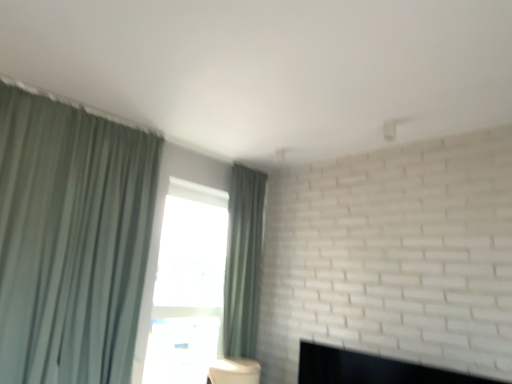
Find the location of a particular element. green fabric curtain at left, which is counted as the 1th curtain, starting from the left is located at coordinates (71, 240).

Measure the distance between black matte fireplace at lower right and camera.

They are 7.15 feet apart.

This screenshot has width=512, height=384. In order to click on green fabric curtain at center, positioned as the second curtain in front-to-back order in this screenshot , I will do `click(243, 262)`.

Identify the location of green fabric curtain at left, arranged as the second curtain when viewed from the right. (71, 240).

Could you tell me if green fabric curtain at left, which is counted as the 1th curtain, starting from the left, is facing black matte fireplace at lower right?

No, green fabric curtain at left, which is counted as the 1th curtain, starting from the left, is not turned towards black matte fireplace at lower right.

From the picture: From a real-world perspective, relative to black matte fireplace at lower right, is green fabric curtain at left, arranged as the second curtain when viewed from the right, vertically above or below?

green fabric curtain at left, arranged as the second curtain when viewed from the right, is situated higher than black matte fireplace at lower right in the real world.

Which of these two, green fabric curtain at left, which is counted as the 1th curtain, starting from the left, or black matte fireplace at lower right, is wider?

green fabric curtain at left, which is counted as the 1th curtain, starting from the left.

How far apart are green fabric curtain at left, positioned as the 2th curtain in back-to-front order, and black matte fireplace at lower right?

green fabric curtain at left, positioned as the 2th curtain in back-to-front order, is 5.18 feet from black matte fireplace at lower right.

Does black matte fireplace at lower right come in front of green fabric curtain at left, which ranks as the first curtain in front-to-back order?

Yes, black matte fireplace at lower right is in front of green fabric curtain at left, which ranks as the first curtain in front-to-back order.

Based on their sizes in the image, would you say black matte fireplace at lower right is bigger or smaller than green fabric curtain at left, arranged as the second curtain when viewed from the right?

In the image, black matte fireplace at lower right appears to be smaller than green fabric curtain at left, arranged as the second curtain when viewed from the right.

Is black matte fireplace at lower right looking in the opposite direction of green fabric curtain at left, which ranks as the first curtain in front-to-back order?

That's not correct — black matte fireplace at lower right is not looking away from green fabric curtain at left, which ranks as the first curtain in front-to-back order.

Is black matte fireplace at lower right looking in the opposite direction of green fabric curtain at center, positioned as the second curtain in front-to-back order?

No, black matte fireplace at lower right is not facing away from green fabric curtain at center, positioned as the second curtain in front-to-back order.

Is black matte fireplace at lower right in front of or behind green fabric curtain at center, positioned as the second curtain in front-to-back order, in the image?

In the image, black matte fireplace at lower right appears in front of green fabric curtain at center, positioned as the second curtain in front-to-back order.

Which point is more distant from viewer, [226,334] or [364,366]?

The point [226,334] is farther.

Measure the distance between green fabric curtain at center, positioned as the second curtain in front-to-back order, and black matte fireplace at lower right.

green fabric curtain at center, positioned as the second curtain in front-to-back order, and black matte fireplace at lower right are 1.17 meters apart.

From a real-world perspective, which object rests below the other?

black matte fireplace at lower right.

Is green fabric curtain at center, which is the 1th curtain in right-to-left order, next to black matte fireplace at lower right?

No, green fabric curtain at center, which is the 1th curtain in right-to-left order, is not with black matte fireplace at lower right.

In the image, is green fabric curtain at center, placed as the second curtain when sorted from left to right, on the left side or the right side of green fabric curtain at left, arranged as the second curtain when viewed from the right?

green fabric curtain at center, placed as the second curtain when sorted from left to right, is positioned on green fabric curtain at left, arranged as the second curtain when viewed from the right,'s right side.

Which of these two, green fabric curtain at center, positioned as the second curtain in front-to-back order, or green fabric curtain at left, which is counted as the 1th curtain, starting from the left, stands shorter?

Standing shorter between the two is green fabric curtain at center, positioned as the second curtain in front-to-back order.

Is green fabric curtain at center, positioned as the second curtain in front-to-back order, looking in the opposite direction of green fabric curtain at left, which ranks as the first curtain in front-to-back order?

No, green fabric curtain at center, positioned as the second curtain in front-to-back order, is not facing away from green fabric curtain at left, which ranks as the first curtain in front-to-back order.

From a real-world perspective, who is located lower, green fabric curtain at left, arranged as the second curtain when viewed from the right, or green fabric curtain at center, the 1th curtain positioned from the back?

In real-world perspective, green fabric curtain at left, arranged as the second curtain when viewed from the right, is lower.

From the image's perspective, is green fabric curtain at left, which is counted as the 1th curtain, starting from the left, positioned above or below green fabric curtain at center, positioned as the second curtain in front-to-back order?

green fabric curtain at left, which is counted as the 1th curtain, starting from the left, is situated higher than green fabric curtain at center, positioned as the second curtain in front-to-back order, in the image.

Which is more to the right, green fabric curtain at left, arranged as the second curtain when viewed from the right, or green fabric curtain at center, which is the 1th curtain in right-to-left order?

green fabric curtain at center, which is the 1th curtain in right-to-left order.

What's the angular difference between green fabric curtain at left, which is counted as the 1th curtain, starting from the left, and green fabric curtain at center, which is the 1th curtain in right-to-left order,'s facing directions?

They differ by 0.394 degrees in their facing directions.

Locate an element on the screen. fireplace that appears in front of the green fabric curtain at left, which ranks as the first curtain in front-to-back order is located at coordinates (370, 369).

This screenshot has height=384, width=512. Identify the location of the 1st curtain behind the black matte fireplace at lower right. (71, 240).

Estimate the real-world distances between objects in this image. Which object is further from green fabric curtain at center, which is the 1th curtain in right-to-left order, black matte fireplace at lower right or green fabric curtain at left, which is counted as the 1th curtain, starting from the left?

green fabric curtain at left, which is counted as the 1th curtain, starting from the left, is further to green fabric curtain at center, which is the 1th curtain in right-to-left order.

Looking at the image, which one is located closer to green fabric curtain at left, which is counted as the 1th curtain, starting from the left, green fabric curtain at center, positioned as the second curtain in front-to-back order, or black matte fireplace at lower right?

green fabric curtain at center, positioned as the second curtain in front-to-back order, lies closer to green fabric curtain at left, which is counted as the 1th curtain, starting from the left, than the other object.

Estimate the real-world distances between objects in this image. Which object is further from green fabric curtain at left, arranged as the second curtain when viewed from the right, black matte fireplace at lower right or green fabric curtain at center, placed as the second curtain when sorted from left to right?

Based on the image, black matte fireplace at lower right appears to be further to green fabric curtain at left, arranged as the second curtain when viewed from the right.

Which object lies further to the anchor point green fabric curtain at center, placed as the second curtain when sorted from left to right, green fabric curtain at left, positioned as the 2th curtain in back-to-front order, or black matte fireplace at lower right?

The object further to green fabric curtain at center, placed as the second curtain when sorted from left to right, is green fabric curtain at left, positioned as the 2th curtain in back-to-front order.

Consider the image. Estimate the real-world distances between objects in this image. Which object is closer to black matte fireplace at lower right, green fabric curtain at center, which is the 1th curtain in right-to-left order, or green fabric curtain at left, which ranks as the first curtain in front-to-back order?

The object closer to black matte fireplace at lower right is green fabric curtain at center, which is the 1th curtain in right-to-left order.

When comparing their distances from black matte fireplace at lower right, does green fabric curtain at left, which is counted as the 1th curtain, starting from the left, or green fabric curtain at center, which is the 1th curtain in right-to-left order, seem closer?

green fabric curtain at center, which is the 1th curtain in right-to-left order, is positioned closer to the anchor black matte fireplace at lower right.

This screenshot has width=512, height=384. What are the coordinates of `curtain between green fabric curtain at left, which ranks as the first curtain in front-to-back order, and black matte fireplace at lower right` in the screenshot? It's located at (243, 262).